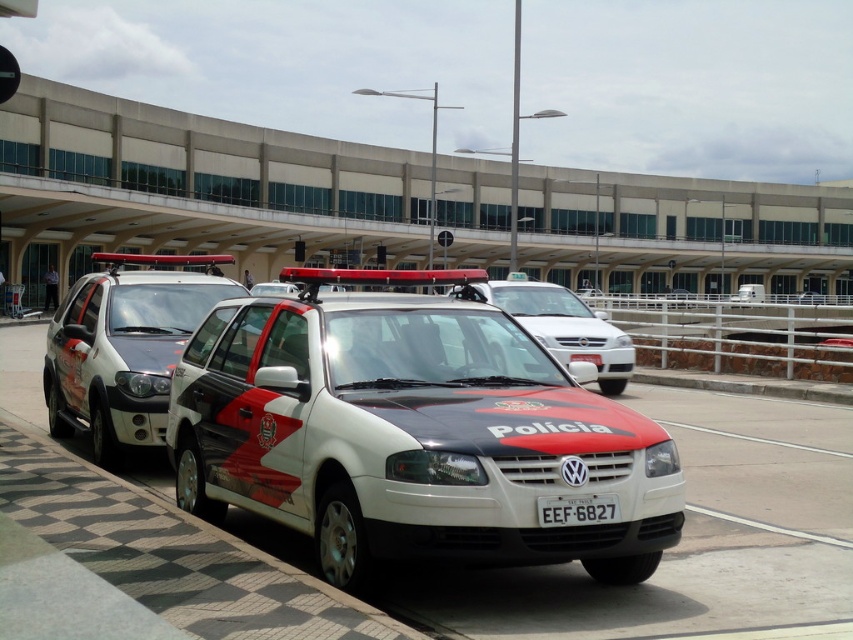
Question: Which is farther from the white plastic license plate at center?

Choices:
 (A) matte black police car at center
 (B) white glossy police car at center
 (C) white matte suv at center

Answer: (C)

Question: Does matte black police car at center lie in front of white plastic license plate at center?

Choices:
 (A) yes
 (B) no

Answer: (B)

Question: Which is nearer to the matte black police car at center?

Choices:
 (A) white matte suv at center
 (B) white plastic license plate at center
 (C) white glossy police car at center

Answer: (C)

Question: Which of the following is the farthest from the observer?

Choices:
 (A) (605, 321)
 (B) (437, 308)

Answer: (A)

Question: Is white matte suv at center behind matte black police car at center?

Choices:
 (A) no
 (B) yes

Answer: (B)

Question: Does white glossy police car at center have a larger size compared to white matte suv at center?

Choices:
 (A) no
 (B) yes

Answer: (A)